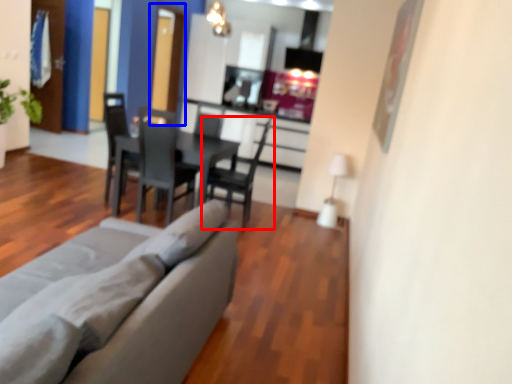
Question: Among these objects, which one is nearest to the camera, chair (highlighted by a red box) or glass door (highlighted by a blue box)?

Choices:
 (A) chair
 (B) glass door

Answer: (A)